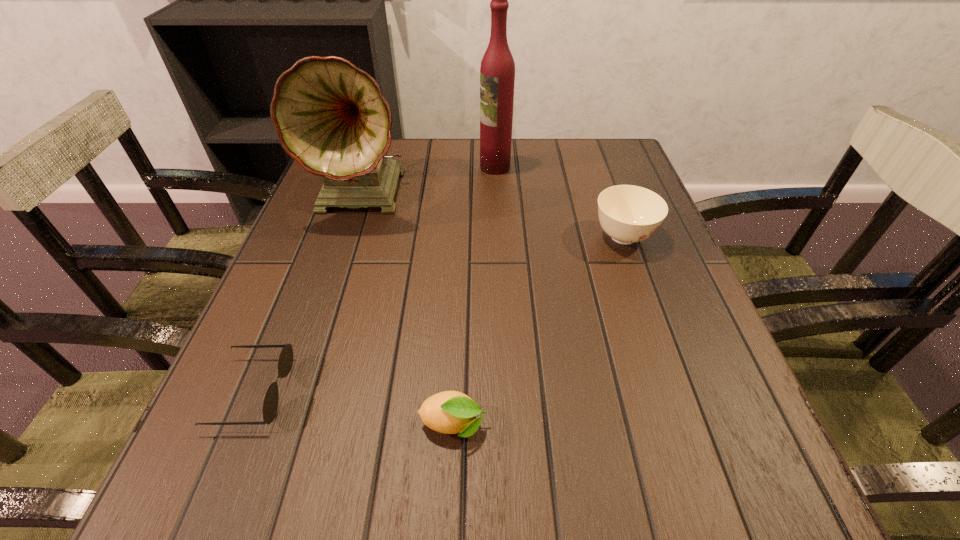
Identify the location of free space located on the left of the rightmost object. (492, 237).

Find the location of a particular element. Image resolution: width=960 pixels, height=540 pixels. vacant area located 0.230m with leaves positioned above the fourth tallest object is located at coordinates (645, 425).

The image size is (960, 540). Identify the location of free region located on the front-facing side of the sunglasses. (383, 392).

Identify the location of liquor situated at the far edge. (497, 72).

Identify the location of record player present at the far edge. (331, 117).

Where is `record player present at the left edge`? The height and width of the screenshot is (540, 960). record player present at the left edge is located at coordinates (331, 117).

Identify the location of sunglasses that is at the left edge. (270, 405).

The height and width of the screenshot is (540, 960). In order to click on object situated at the right edge in this screenshot , I will do `click(628, 214)`.

Where is `object that is at the far left corner`? Image resolution: width=960 pixels, height=540 pixels. object that is at the far left corner is located at coordinates (331, 117).

Where is `vacant space at the far edge of the desktop`? Image resolution: width=960 pixels, height=540 pixels. vacant space at the far edge of the desktop is located at coordinates pos(434,163).